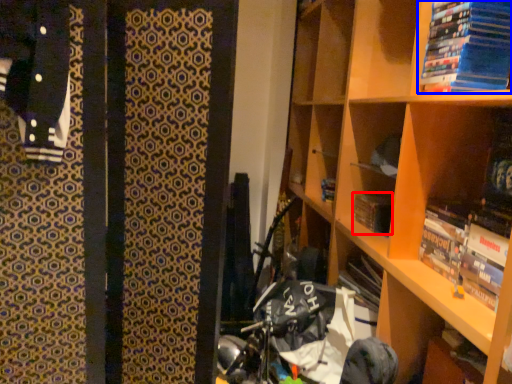
Question: Which point is closer to the camera, paperback book (highlighted by a red box) or book (highlighted by a blue box)?

Choices:
 (A) paperback book
 (B) book

Answer: (B)